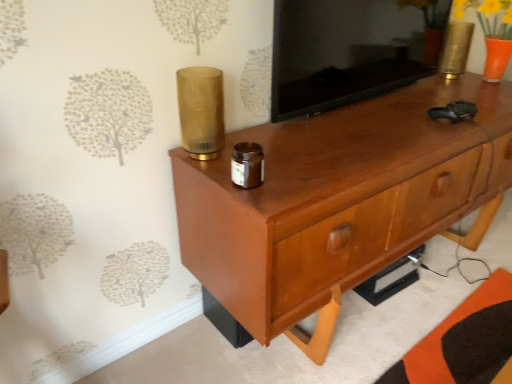
Question: From a real-world perspective, is translucent amber glass at upper center, the first candle holder in the bottom-to-top sequence, on top of gold metallic vase at upper right, placed as the 1th candle holder when sorted from top to bottom?

Choices:
 (A) yes
 (B) no

Answer: (A)

Question: Can you confirm if translucent amber glass at upper center, positioned as the first candle holder in left-to-right order, is wider than gold metallic vase at upper right, acting as the 2th candle holder starting from the left?

Choices:
 (A) yes
 (B) no

Answer: (A)

Question: Does translucent amber glass at upper center, positioned as the 2th candle holder in right-to-left order, have a lesser height compared to gold metallic vase at upper right, the 2th candle holder from the front?

Choices:
 (A) no
 (B) yes

Answer: (A)

Question: Considering the relative positions of translucent amber glass at upper center, the first candle holder in the bottom-to-top sequence, and gold metallic vase at upper right, the 2th candle holder positioned from the bottom, in the image provided, is translucent amber glass at upper center, the first candle holder in the bottom-to-top sequence, to the left of gold metallic vase at upper right, the 2th candle holder positioned from the bottom, from the viewer's perspective?

Choices:
 (A) no
 (B) yes

Answer: (B)

Question: Does translucent amber glass at upper center, positioned as the 2th candle holder in right-to-left order, come in front of gold metallic vase at upper right, the first candle holder viewed from the right?

Choices:
 (A) no
 (B) yes

Answer: (B)

Question: Is translucent amber glass at upper center, positioned as the 2th candle holder in right-to-left order, spatially inside matte wood tv cabinet at upper center, or outside of it?

Choices:
 (A) inside
 (B) outside

Answer: (B)

Question: Is point (181, 127) positioned closer to the camera than point (300, 24)?

Choices:
 (A) closer
 (B) farther

Answer: (A)

Question: Considering the positions of translucent amber glass at upper center, positioned as the 2th candle holder in right-to-left order, and matte wood tv cabinet at upper center in the image, is translucent amber glass at upper center, positioned as the 2th candle holder in right-to-left order, wider or thinner than matte wood tv cabinet at upper center?

Choices:
 (A) wide
 (B) thin

Answer: (A)

Question: Considering the relative positions of translucent amber glass at upper center, positioned as the first candle holder in left-to-right order, and matte wood tv cabinet at upper center in the image provided, is translucent amber glass at upper center, positioned as the first candle holder in left-to-right order, to the left or to the right of matte wood tv cabinet at upper center?

Choices:
 (A) left
 (B) right

Answer: (A)

Question: From a real-world perspective, relative to translucent amber glass at upper center, the second candle holder when ordered from top to bottom, is gold metallic vase at upper right, the 2th candle holder positioned from the bottom, vertically above or below?

Choices:
 (A) above
 (B) below

Answer: (B)

Question: Based on their positions, is gold metallic vase at upper right, the 1th candle holder viewed from the back, located to the left or right of translucent amber glass at upper center, the first candle holder in the bottom-to-top sequence?

Choices:
 (A) right
 (B) left

Answer: (A)

Question: Is gold metallic vase at upper right, the 1th candle holder viewed from the back, spatially inside translucent amber glass at upper center, the first candle holder in the bottom-to-top sequence, or outside of it?

Choices:
 (A) inside
 (B) outside

Answer: (B)

Question: Is gold metallic vase at upper right, the 2th candle holder positioned from the bottom, bigger or smaller than translucent amber glass at upper center, arranged as the first candle holder when viewed from the front?

Choices:
 (A) big
 (B) small

Answer: (A)

Question: Is matte wood tv cabinet at upper center to the left or to the right of glossy wood chest of drawers at center in the image?

Choices:
 (A) left
 (B) right

Answer: (A)

Question: Does point (342, 72) appear closer or farther from the camera than point (368, 175)?

Choices:
 (A) farther
 (B) closer

Answer: (A)